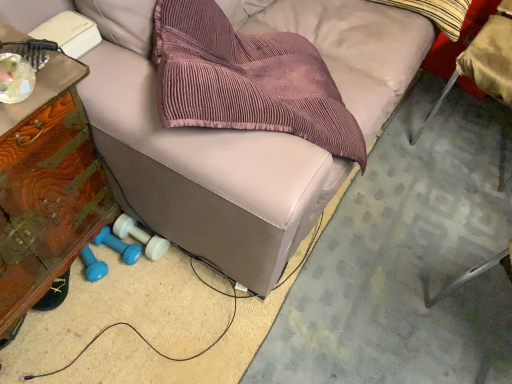
Locate an element on the screen. The height and width of the screenshot is (384, 512). leather couch at center, which is the second furniture from left to right is located at coordinates (207, 174).

Where is `striped cotton throw pillow at upper right`? striped cotton throw pillow at upper right is located at coordinates (436, 13).

What is the approximate width of metallic silver chair at lower right?

metallic silver chair at lower right is 59.10 centimeters wide.

The image size is (512, 384). What do you see at coordinates (485, 62) in the screenshot?
I see `metallic silver chair at lower right` at bounding box center [485, 62].

Describe the element at coordinates (118, 246) in the screenshot. This screenshot has width=512, height=384. I see `blue rubber dumbbell at lower left, which is the first dumbbell in left-to-right order` at that location.

Locate an element on the screen. The height and width of the screenshot is (384, 512). leather couch at center, arranged as the first furniture when viewed from the right is located at coordinates (207, 174).

Between wooden side table at left, the first furniture in the left-to-right sequence, and striped cotton throw pillow at upper right, which one has smaller size?

striped cotton throw pillow at upper right is smaller.

From a real-world perspective, is wooden side table at left, the first furniture in the left-to-right sequence, positioned under striped cotton throw pillow at upper right based on gravity?

Indeed, from a real-world perspective, wooden side table at left, the first furniture in the left-to-right sequence, is positioned beneath striped cotton throw pillow at upper right.

Consider the image. From the image's perspective, is wooden side table at left, the first furniture in the left-to-right sequence, on top of striped cotton throw pillow at upper right?

Incorrect, from the image's perspective, wooden side table at left, the first furniture in the left-to-right sequence, is lower than striped cotton throw pillow at upper right.

Is wooden side table at left, the first furniture in the left-to-right sequence, positioned behind striped cotton throw pillow at upper right?

No, wooden side table at left, the first furniture in the left-to-right sequence, is in front of striped cotton throw pillow at upper right.

Considering the relative sizes of wooden side table at left, the second furniture positioned from the right, and metallic silver chair at lower right in the image provided, is wooden side table at left, the second furniture positioned from the right, smaller than metallic silver chair at lower right?

No, wooden side table at left, the second furniture positioned from the right, is not smaller than metallic silver chair at lower right.

From the image's perspective, which is above, wooden side table at left, the first furniture in the left-to-right sequence, or metallic silver chair at lower right?

metallic silver chair at lower right is shown above in the image.

Does wooden side table at left, the first furniture in the left-to-right sequence, appear on the right side of metallic silver chair at lower right?

No.

How different are the orientations of wooden side table at left, the first furniture in the left-to-right sequence, and metallic silver chair at lower right in degrees?

wooden side table at left, the first furniture in the left-to-right sequence, and metallic silver chair at lower right are facing 92.4 degrees away from each other.

Is metallic silver chair at lower right wider than wooden side table at left, the second furniture positioned from the right?

Indeed, metallic silver chair at lower right has a greater width compared to wooden side table at left, the second furniture positioned from the right.

Does metallic silver chair at lower right come in front of wooden side table at left, the first furniture in the left-to-right sequence?

No, it is behind wooden side table at left, the first furniture in the left-to-right sequence.

How distant is metallic silver chair at lower right from wooden side table at left, the first furniture in the left-to-right sequence?

metallic silver chair at lower right and wooden side table at left, the first furniture in the left-to-right sequence, are 1.38 meters apart from each other.

How different are the orientations of metallic silver chair at lower right and wooden side table at left, the first furniture in the left-to-right sequence, in degrees?

metallic silver chair at lower right and wooden side table at left, the first furniture in the left-to-right sequence, are facing 92.4 degrees away from each other.

Would you consider wooden side table at left, the first furniture in the left-to-right sequence, to be distant from blue rubber dumbbell at lower left, arranged as the 1th dumbbell when viewed from the right?

No, wooden side table at left, the first furniture in the left-to-right sequence, is not far away from blue rubber dumbbell at lower left, arranged as the 1th dumbbell when viewed from the right.

Is wooden side table at left, the second furniture positioned from the right, looking in the opposite direction of blue rubber dumbbell at lower left, the 2th dumbbell in the left-to-right sequence?

That's not correct — wooden side table at left, the second furniture positioned from the right, is not looking away from blue rubber dumbbell at lower left, the 2th dumbbell in the left-to-right sequence.

Which point is more distant from viewer, (18,212) or (156,247)?

The point (156,247) is farther from the camera.

Which dumbbell is the 2nd one when counting from the right side of the wooden side table at left, the first furniture in the left-to-right sequence? Please provide its 2D coordinates.

[(140, 237)]

Is the depth of blue rubber dumbbell at lower left, arranged as the 1th dumbbell when viewed from the right, less than that of striped cotton throw pillow at upper right?

Yes, it is.

From the image's perspective, which is above, blue rubber dumbbell at lower left, the 2th dumbbell in the left-to-right sequence, or striped cotton throw pillow at upper right?

striped cotton throw pillow at upper right is shown above in the image.

Is blue rubber dumbbell at lower left, arranged as the 1th dumbbell when viewed from the right, far from striped cotton throw pillow at upper right?

Yes.

Is blue rubber dumbbell at lower left, the 2th dumbbell in the left-to-right sequence, at the left side of striped cotton throw pillow at upper right?

Indeed, blue rubber dumbbell at lower left, the 2th dumbbell in the left-to-right sequence, is positioned on the left side of striped cotton throw pillow at upper right.

Would you say blue rubber dumbbell at lower left, arranged as the 1th dumbbell when viewed from the right, is outside blue rubber dumbbell at lower left, which is the first dumbbell in left-to-right order?

blue rubber dumbbell at lower left, arranged as the 1th dumbbell when viewed from the right, is positioned outside blue rubber dumbbell at lower left, which is the first dumbbell in left-to-right order.

At what (x,y) coordinates should I click in order to perform the action: click on dumbbell below the blue rubber dumbbell at lower left, the 2th dumbbell in the left-to-right sequence (from a real-world perspective). Please return your answer as a coordinate pair (x, y). Looking at the image, I should click on (118, 246).

Does blue rubber dumbbell at lower left, arranged as the 1th dumbbell when viewed from the right, appear on the right side of blue rubber dumbbell at lower left, which is the first dumbbell in left-to-right order?

Correct, you'll find blue rubber dumbbell at lower left, arranged as the 1th dumbbell when viewed from the right, to the right of blue rubber dumbbell at lower left, which is the first dumbbell in left-to-right order.

How far apart are blue rubber dumbbell at lower left, arranged as the 1th dumbbell when viewed from the right, and blue rubber dumbbell at lower left, which is the first dumbbell in left-to-right order?

blue rubber dumbbell at lower left, arranged as the 1th dumbbell when viewed from the right, is 4.14 centimeters away from blue rubber dumbbell at lower left, which is the first dumbbell in left-to-right order.

How many degrees apart are the facing directions of striped cotton throw pillow at upper right and wooden side table at left, the second furniture positioned from the right?

They differ by 84 degrees in their facing directions.

Consider the image. Choose the correct answer: Is striped cotton throw pillow at upper right inside wooden side table at left, the first furniture in the left-to-right sequence, or outside it?

striped cotton throw pillow at upper right cannot be found inside wooden side table at left, the first furniture in the left-to-right sequence.

Is striped cotton throw pillow at upper right directly adjacent to wooden side table at left, the second furniture positioned from the right?

No, striped cotton throw pillow at upper right is not next to wooden side table at left, the second furniture positioned from the right.

Between striped cotton throw pillow at upper right and wooden side table at left, the second furniture positioned from the right, which one has more height?

Standing taller between the two is wooden side table at left, the second furniture positioned from the right.

Where is `the 2nd furniture below the striped cotton throw pillow at upper right (from the image's perspective)`? the 2nd furniture below the striped cotton throw pillow at upper right (from the image's perspective) is located at coordinates (46, 188).

The width and height of the screenshot is (512, 384). Find the location of `chair on the right of the wooden side table at left, the first furniture in the left-to-right sequence`. chair on the right of the wooden side table at left, the first furniture in the left-to-right sequence is located at coordinates (485, 62).

When comparing their distances from blue rubber dumbbell at lower left, which is the first dumbbell in left-to-right order, does blue rubber dumbbell at lower left, the 2th dumbbell in the left-to-right sequence, or metallic silver chair at lower right seem closer?

blue rubber dumbbell at lower left, the 2th dumbbell in the left-to-right sequence.

Which object lies further to the anchor point blue rubber dumbbell at lower left, the 2th dumbbell in the left-to-right sequence, metallic silver chair at lower right or wooden side table at left, the second furniture positioned from the right?

Based on the image, metallic silver chair at lower right appears to be further to blue rubber dumbbell at lower left, the 2th dumbbell in the left-to-right sequence.

From the image, which object appears to be nearer to blue rubber dumbbell at lower left, arranged as the 1th dumbbell when viewed from the right, wooden side table at left, the first furniture in the left-to-right sequence, or striped cotton throw pillow at upper right?

Among the two, wooden side table at left, the first furniture in the left-to-right sequence, is located nearer to blue rubber dumbbell at lower left, arranged as the 1th dumbbell when viewed from the right.

When comparing their distances from leather couch at center, arranged as the first furniture when viewed from the right, does striped cotton throw pillow at upper right or wooden side table at left, the first furniture in the left-to-right sequence, seem closer?

Among the two, wooden side table at left, the first furniture in the left-to-right sequence, is located nearer to leather couch at center, arranged as the first furniture when viewed from the right.

Which object lies further to the anchor point blue rubber dumbbell at lower left, acting as the 2th dumbbell starting from the right, wooden side table at left, the first furniture in the left-to-right sequence, or blue rubber dumbbell at lower left, arranged as the 1th dumbbell when viewed from the right?

Among the two, wooden side table at left, the first furniture in the left-to-right sequence, is located further to blue rubber dumbbell at lower left, acting as the 2th dumbbell starting from the right.

Based on their spatial positions, is striped cotton throw pillow at upper right or wooden side table at left, the first furniture in the left-to-right sequence, further from metallic silver chair at lower right?

Among the two, wooden side table at left, the first furniture in the left-to-right sequence, is located further to metallic silver chair at lower right.

Which object lies nearer to the anchor point blue rubber dumbbell at lower left, which is the first dumbbell in left-to-right order, leather couch at center, which is the second furniture from left to right, or blue rubber dumbbell at lower left, the 2th dumbbell in the left-to-right sequence?

blue rubber dumbbell at lower left, the 2th dumbbell in the left-to-right sequence, is closer to blue rubber dumbbell at lower left, which is the first dumbbell in left-to-right order.

Estimate the real-world distances between objects in this image. Which object is closer to wooden side table at left, the first furniture in the left-to-right sequence, blue rubber dumbbell at lower left, which is the first dumbbell in left-to-right order, or metallic silver chair at lower right?

Among the two, blue rubber dumbbell at lower left, which is the first dumbbell in left-to-right order, is located nearer to wooden side table at left, the first furniture in the left-to-right sequence.

Find the location of a particular element. The height and width of the screenshot is (384, 512). furniture between wooden side table at left, the second furniture positioned from the right, and metallic silver chair at lower right, in the horizontal direction is located at coordinates (207, 174).

I want to click on throw pillow between blue rubber dumbbell at lower left, the 2th dumbbell in the left-to-right sequence, and metallic silver chair at lower right, so click(436, 13).

Where is `dumbbell between leather couch at center, arranged as the first furniture when viewed from the right, and blue rubber dumbbell at lower left, which is the first dumbbell in left-to-right order, in the vertical direction`? The width and height of the screenshot is (512, 384). dumbbell between leather couch at center, arranged as the first furniture when viewed from the right, and blue rubber dumbbell at lower left, which is the first dumbbell in left-to-right order, in the vertical direction is located at coordinates (140, 237).

Locate an element on the screen. This screenshot has height=384, width=512. furniture situated between blue rubber dumbbell at lower left, acting as the 2th dumbbell starting from the right, and striped cotton throw pillow at upper right from left to right is located at coordinates (207, 174).